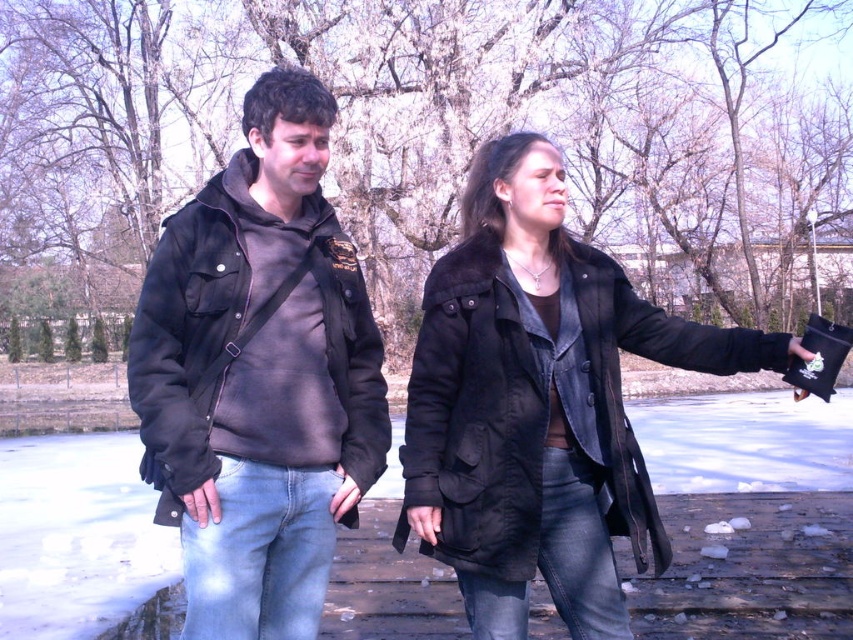
You are a photographer trying to capture a photo of both the matte black jacket at left and the matte black coat at center. Since you want to ensure both are in focus, you need to know which one is closer to you. Can you determine which one is nearer?

The matte black jacket at left is closer to the viewer than the matte black coat at center, so you should focus on the matte black jacket at left first to ensure both are in focus.

You are standing at the edge of the dock looking towards the two points marked in the image. Which point, point (288, 163) or point (456, 496), is nearer to you?

Point (288, 163) is closer to the camera than point (456, 496), so the point nearer to you is point (288, 163).